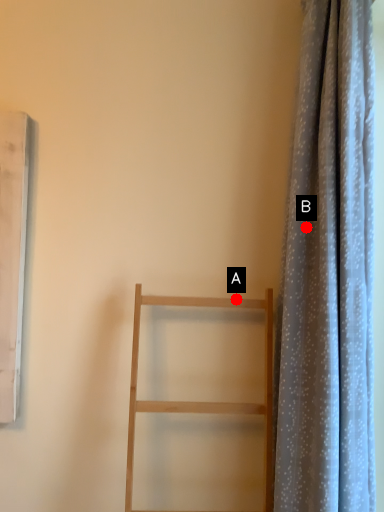
Question: Two points are circled on the image, labeled by A and B beside each circle. Which point appears farthest from the camera in this image?

Choices:
 (A) A is further
 (B) B is further

Answer: (A)